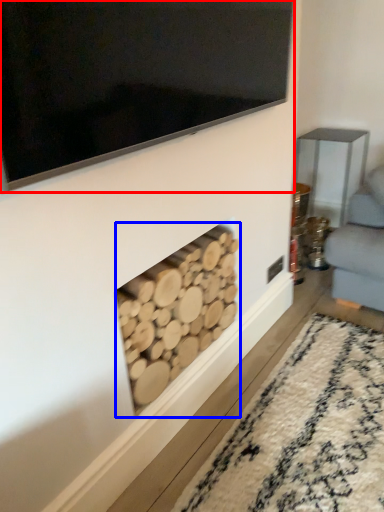
Question: Which object appears closest to the camera in this image, television (highlighted by a red box) or fireplace (highlighted by a blue box)?

Choices:
 (A) television
 (B) fireplace

Answer: (A)